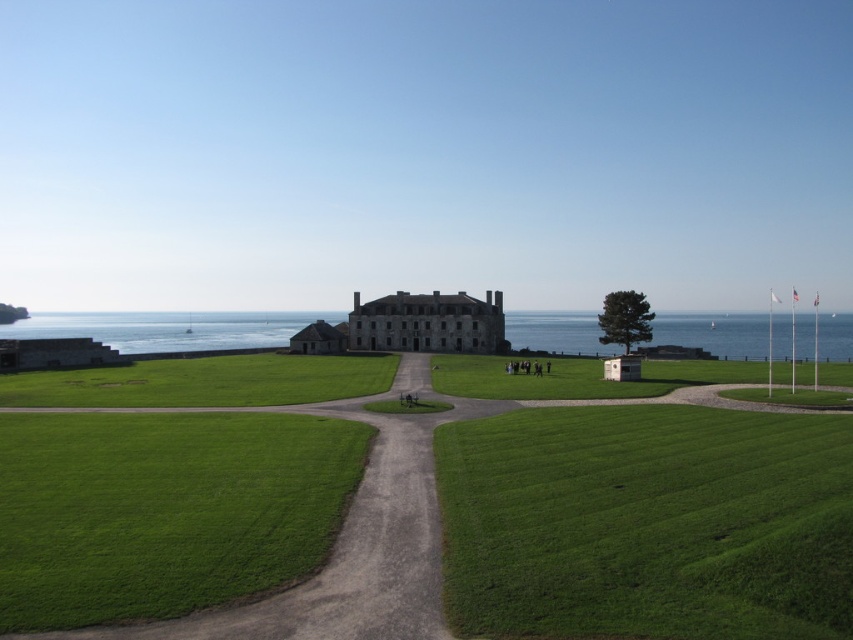
You are standing at the entrance of the historic stone building and want to walk towards the point marked as point (691, 403). However, there is an obstacle located at point (540, 316). Will you encounter this obstacle on your path?

Yes, you will encounter the obstacle at point (540, 316) because point (691, 403) is in front of point (540, 316), meaning the obstacle is along the path towards your destination.

You are standing at the entrance of the historic stone building and want to reach the green grass at center. Which direction should you walk to get there?

The green grass at center is located at point (409, 472), so you should walk towards the center of the grassy area where the pathways converge to reach it.

You are planning to walk from the blue water at lower left to the green grass at center. Which direction should you head?

The green grass at center is to the right of blue water at lower left, so you should head to the right.